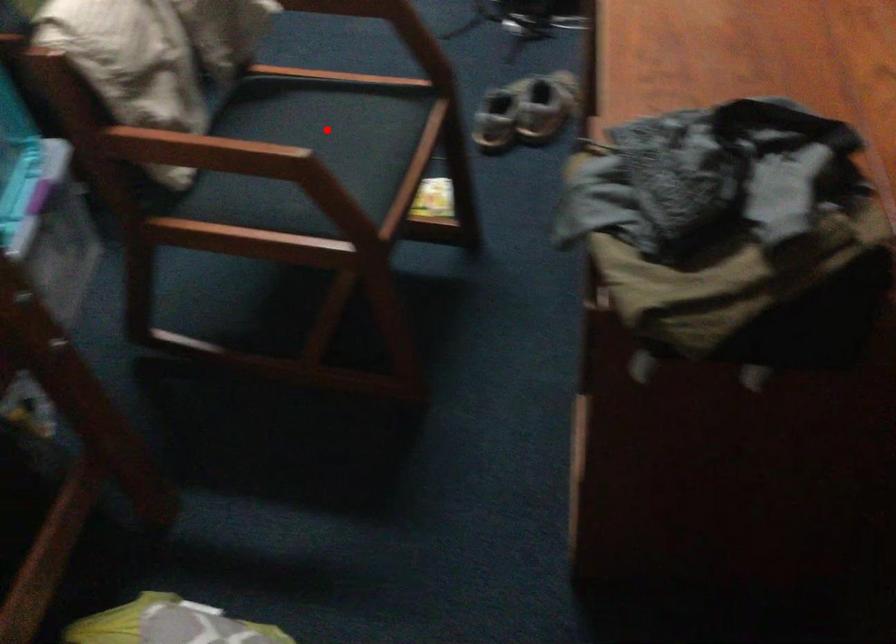
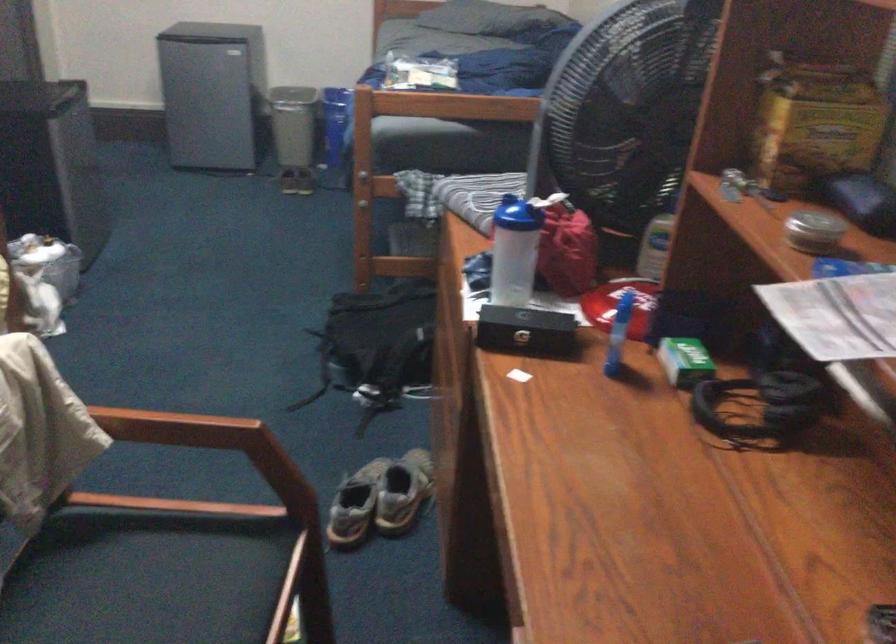
Locate, in the second image, the point that corresponds to the highlighted location in the first image.

(162, 579)